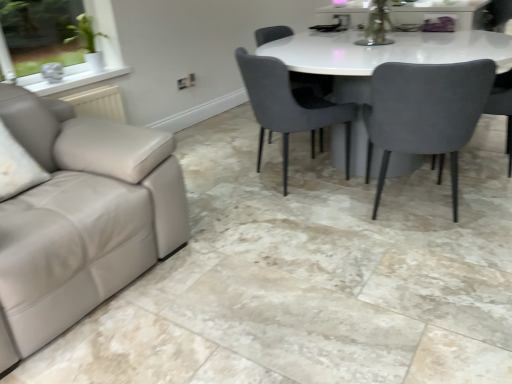
This screenshot has height=384, width=512. I want to click on vacant space that is in between velvet grey chair at center, which appears as the 4th chair when viewed from the right, and suede gray chair at right, arranged as the third chair when viewed from the left, so (x=343, y=198).